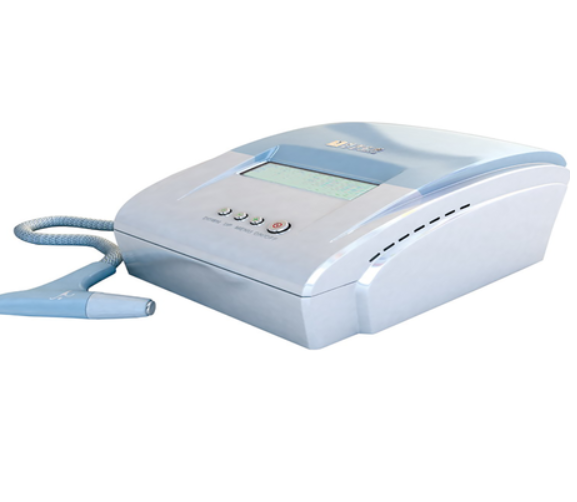
At what (x,y) coordinates should I click in order to perform the action: click on screen. Please return your answer as a coordinate pair (x, y). Looking at the image, I should click on (309, 185).